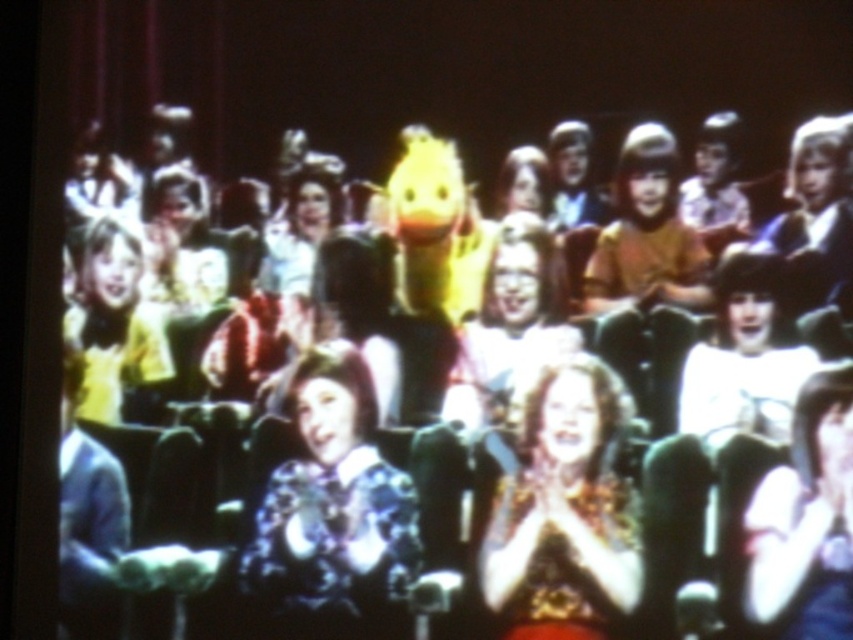
Question: Which point is closer to the camera?

Choices:
 (A) curly hair at center
 (B) floral-patterned blouse at center
 (C) matte yellow shirt at left
 (D) matte black dress at center

Answer: (D)

Question: Which object is farther from the camera taking this photo?

Choices:
 (A) curly hair at center
 (B) floral-patterned blouse at center

Answer: (B)

Question: Is curly hair at center further to camera compared to matte black dress at center?

Choices:
 (A) no
 (B) yes

Answer: (B)

Question: Which point is closer to the camera?

Choices:
 (A) (250, 557)
 (B) (585, 636)
 (C) (780, 493)

Answer: (C)

Question: Does floral-patterned blouse at center appear over matte yellow shirt at left?

Choices:
 (A) yes
 (B) no

Answer: (B)

Question: Does curly hair at center appear over matte yellow shirt at left?

Choices:
 (A) yes
 (B) no

Answer: (B)